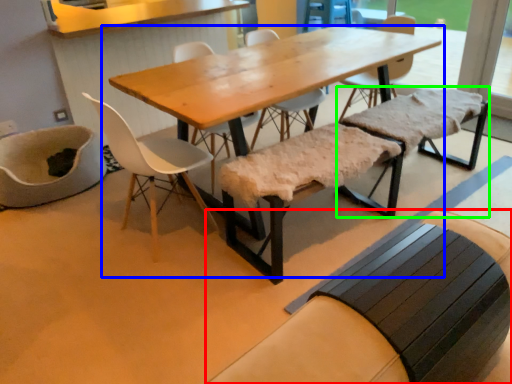
Question: Considering the real-world distances, which object is closest to church bench (highlighted by a red box)? table (highlighted by a blue box) or church bench (highlighted by a green box).

Choices:
 (A) table
 (B) church bench

Answer: (A)